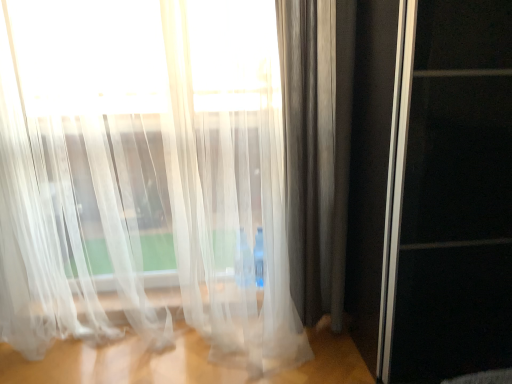
Question: Would you say transparent glass screen door at right is a long distance from satin gray curtain at right, placed as the 1th curtain when sorted from right to left?

Choices:
 (A) no
 (B) yes

Answer: (A)

Question: Is satin gray curtain at right, placed as the second curtain when sorted from left to right, at the back of transparent glass screen door at right?

Choices:
 (A) no
 (B) yes

Answer: (A)

Question: Does transparent glass screen door at right touch satin gray curtain at right, placed as the second curtain when sorted from left to right?

Choices:
 (A) yes
 (B) no

Answer: (B)

Question: From a real-world perspective, is transparent glass screen door at right positioned under satin gray curtain at right, placed as the second curtain when sorted from left to right, based on gravity?

Choices:
 (A) no
 (B) yes

Answer: (B)

Question: Does transparent glass screen door at right appear on the right side of satin gray curtain at right, placed as the 1th curtain when sorted from right to left?

Choices:
 (A) no
 (B) yes

Answer: (B)

Question: Would you say transparent glass screen door at right is inside or outside translucent white curtain at left, which is the 2th curtain from right to left?

Choices:
 (A) outside
 (B) inside

Answer: (A)

Question: Considering the positions of transparent glass screen door at right and translucent white curtain at left, positioned as the first curtain in left-to-right order, in the image, is transparent glass screen door at right taller or shorter than translucent white curtain at left, positioned as the first curtain in left-to-right order,?

Choices:
 (A) short
 (B) tall

Answer: (A)

Question: In terms of size, does transparent glass screen door at right appear bigger or smaller than translucent white curtain at left, positioned as the first curtain in left-to-right order?

Choices:
 (A) big
 (B) small

Answer: (A)

Question: Looking at their shapes, would you say transparent glass screen door at right is wider or thinner than translucent white curtain at left, which is the 2th curtain from right to left?

Choices:
 (A) thin
 (B) wide

Answer: (B)

Question: Is point (324, 276) closer or farther from the camera than point (487, 173)?

Choices:
 (A) farther
 (B) closer

Answer: (A)

Question: Based on their sizes in the image, would you say satin gray curtain at right, placed as the second curtain when sorted from left to right, is bigger or smaller than transparent glass screen door at right?

Choices:
 (A) big
 (B) small

Answer: (B)

Question: Which is correct: satin gray curtain at right, placed as the 1th curtain when sorted from right to left, is inside transparent glass screen door at right, or outside of it?

Choices:
 (A) outside
 (B) inside

Answer: (A)

Question: In the image, is satin gray curtain at right, placed as the 1th curtain when sorted from right to left, positioned in front of or behind transparent glass screen door at right?

Choices:
 (A) front
 (B) behind

Answer: (B)

Question: Is point (122, 115) closer or farther from the camera than point (290, 29)?

Choices:
 (A) closer
 (B) farther

Answer: (B)

Question: Considering the relative positions of translucent white curtain at left, which is the 2th curtain from right to left, and satin gray curtain at right, placed as the second curtain when sorted from left to right, in the image provided, is translucent white curtain at left, which is the 2th curtain from right to left, to the left or to the right of satin gray curtain at right, placed as the second curtain when sorted from left to right,?

Choices:
 (A) right
 (B) left

Answer: (B)